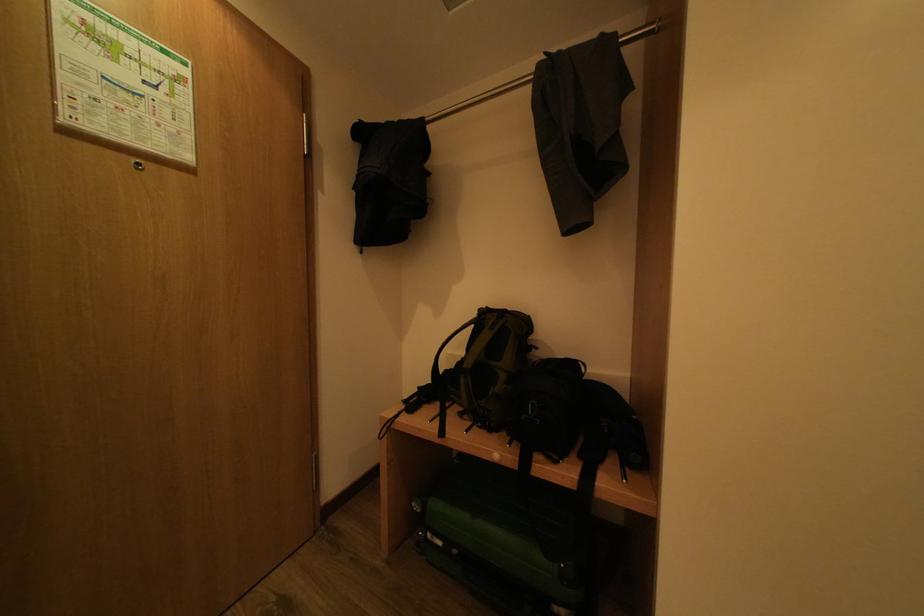
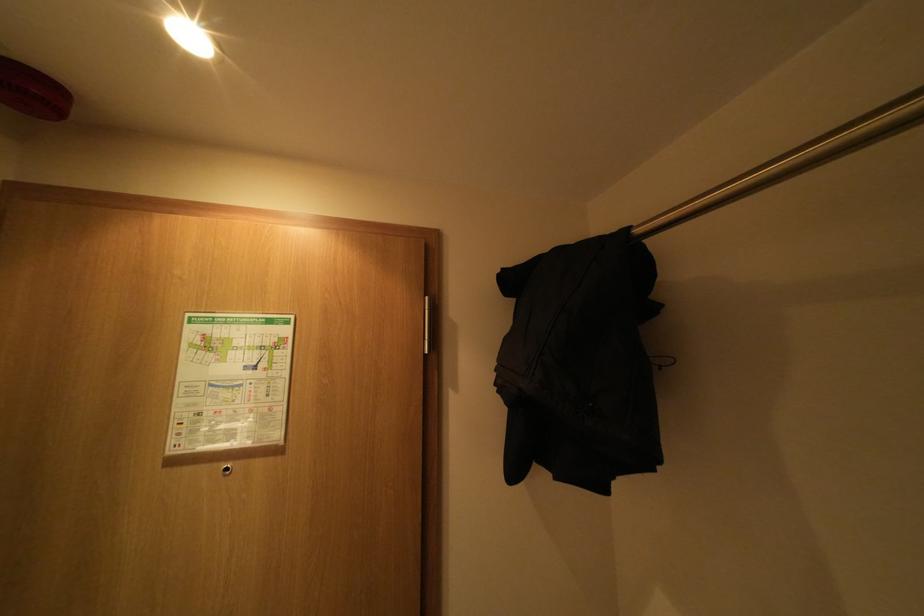
Question: How did the camera likely rotate?

Choices:
 (A) Left
 (B) Right
 (C) Up
 (D) Down

Answer: (A)